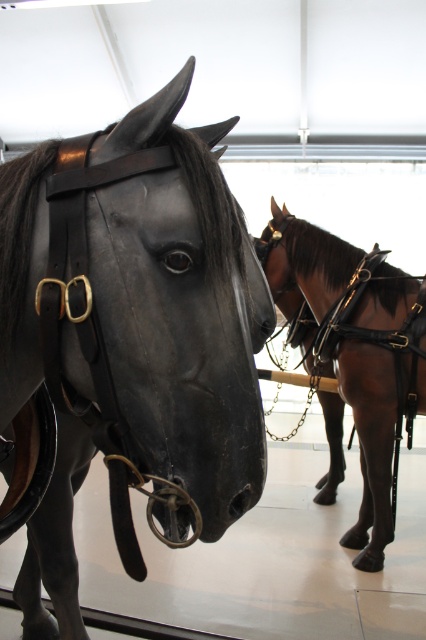
Where is `black polished wood horse at center`? The width and height of the screenshot is (426, 640). black polished wood horse at center is located at coordinates (132, 337).

Locate an element on the screen. This screenshot has height=640, width=426. black polished wood horse at center is located at coordinates (132, 337).

Find the location of `black polished wood horse at center`. black polished wood horse at center is located at coordinates (132, 337).